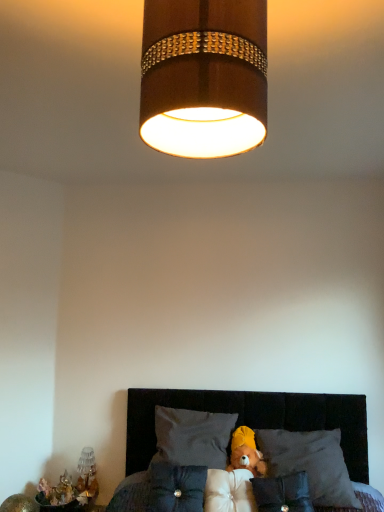
Question: From a real-world perspective, is velvety gray pillow at center, the 5th pillow viewed from the right, located higher than wooden lampshade at upper center?

Choices:
 (A) no
 (B) yes

Answer: (A)

Question: Could you tell me if velvety gray pillow at center, placed as the 1th pillow when sorted from left to right, is facing wooden lampshade at upper center?

Choices:
 (A) yes
 (B) no

Answer: (B)

Question: From the image's perspective, is velvety gray pillow at center, placed as the 1th pillow when sorted from left to right, located above wooden lampshade at upper center?

Choices:
 (A) yes
 (B) no

Answer: (B)

Question: Does velvety gray pillow at center, the 5th pillow viewed from the right, have a larger size compared to wooden lampshade at upper center?

Choices:
 (A) yes
 (B) no

Answer: (A)

Question: From the image's perspective, is velvety gray pillow at center, the 5th pillow viewed from the right, below wooden lampshade at upper center?

Choices:
 (A) no
 (B) yes

Answer: (B)

Question: In terms of height, does fluffy brown teddy bear at center look taller or shorter compared to velvet dark gray bed at center?

Choices:
 (A) short
 (B) tall

Answer: (A)

Question: Considering the positions of point (236, 433) and point (140, 487), is point (236, 433) closer or farther from the camera than point (140, 487)?

Choices:
 (A) farther
 (B) closer

Answer: (A)

Question: Choose the correct answer: Is fluffy brown teddy bear at center inside velvet dark gray bed at center or outside it?

Choices:
 (A) inside
 (B) outside

Answer: (A)

Question: From the image's perspective, is fluffy brown teddy bear at center positioned above or below velvet dark gray bed at center?

Choices:
 (A) below
 (B) above

Answer: (B)

Question: Is fluffy brown teddy bear at center spatially inside velvety gray pillow at center, the 5th pillow viewed from the right, or outside of it?

Choices:
 (A) outside
 (B) inside

Answer: (A)

Question: From the image's perspective, is fluffy brown teddy bear at center located above or below velvety gray pillow at center, the 5th pillow viewed from the right?

Choices:
 (A) above
 (B) below

Answer: (A)

Question: Is fluffy brown teddy bear at center in front of or behind velvety gray pillow at center, placed as the 1th pillow when sorted from left to right, in the image?

Choices:
 (A) behind
 (B) front

Answer: (A)

Question: Considering the positions of fluffy brown teddy bear at center and velvety gray pillow at center, placed as the 1th pillow when sorted from left to right, in the image, is fluffy brown teddy bear at center bigger or smaller than velvety gray pillow at center, placed as the 1th pillow when sorted from left to right,?

Choices:
 (A) small
 (B) big

Answer: (A)

Question: From a real-world perspective, is velvet dark gray bed at center above or below fluffy brown teddy bear at center?

Choices:
 (A) below
 (B) above

Answer: (A)

Question: Considering their positions, is velvet dark gray bed at center located in front of or behind fluffy brown teddy bear at center?

Choices:
 (A) front
 (B) behind

Answer: (A)